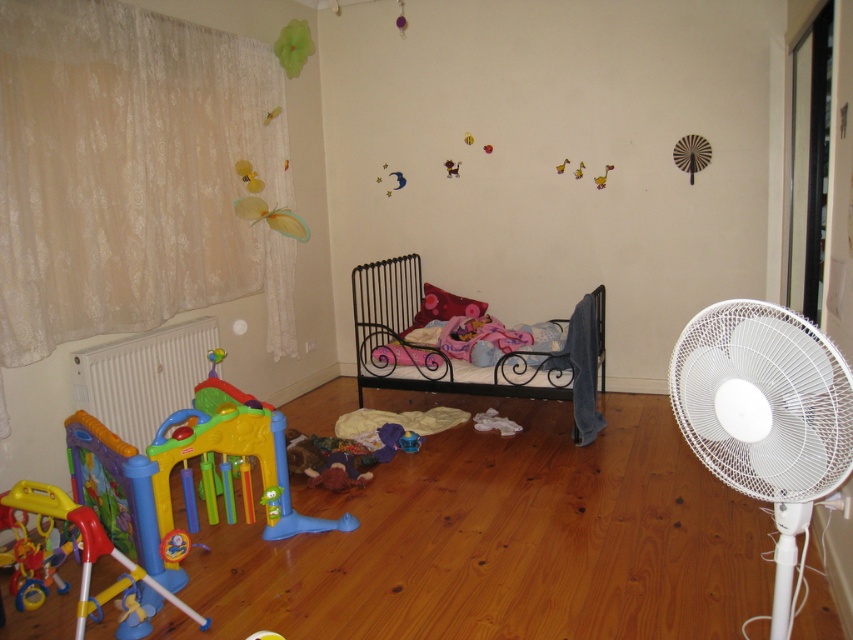
At what (x,y) coordinates should I click in order to perform the action: click on white plastic fan at right. Please return your answer as a coordinate pair (x, y). Image resolution: width=853 pixels, height=640 pixels. Looking at the image, I should click on (764, 417).

Can you confirm if plastic/soft walker at lower left is shorter than pink fabric pillow at center?

Incorrect, plastic/soft walker at lower left's height does not fall short of pink fabric pillow at center's.

Is plastic/soft walker at lower left wider than pink fabric pillow at center?

Indeed, plastic/soft walker at lower left has a greater width compared to pink fabric pillow at center.

Identify the location of plastic/soft walker at lower left. The width and height of the screenshot is (853, 640). (86, 547).

I want to click on plastic/soft walker at lower left, so click(x=86, y=547).

Does white lace curtain at left have a smaller size compared to pink fabric pillow at center?

No, white lace curtain at left is not smaller than pink fabric pillow at center.

Does white lace curtain at left have a lesser width compared to pink fabric pillow at center?

No.

Who is more distant from viewer, (190, 140) or (434, 308)?

Positioned behind is point (434, 308).

I want to click on white lace curtain at left, so click(129, 173).